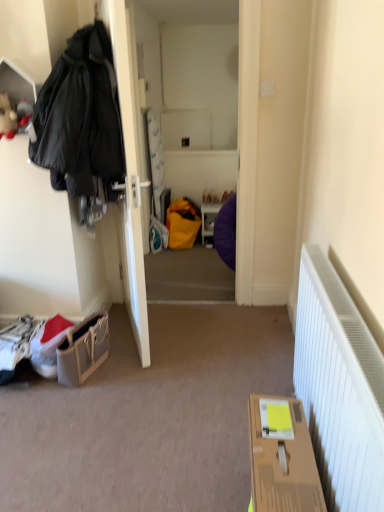
This screenshot has width=384, height=512. What do you see at coordinates (193, 102) in the screenshot? I see `matte purple bean bag at center` at bounding box center [193, 102].

The height and width of the screenshot is (512, 384). Describe the element at coordinates (83, 350) in the screenshot. I see `leather textured handbag at lower left` at that location.

What do you see at coordinates (282, 458) in the screenshot? I see `cardboard box at lower right` at bounding box center [282, 458].

Measure the distance between point (295, 446) and camera.

The depth of point (295, 446) is 1.34 meters.

In order to face matte white door at left, should I rotate leftwards or rightwards?

It's best to rotate left around 9.053 degrees.

Find the location of a particular element. Image resolution: width=384 pixels, height=512 pixels. matte purple bean bag at center is located at coordinates (193, 102).

From the image's perspective, between matte purple bean bag at center and fluffy plush toy at upper left, who is located below?

matte purple bean bag at center, from the image's perspective.

How different are the orientations of matte purple bean bag at center and fluffy plush toy at upper left in degrees?

1.65 degrees separate the facing orientations of matte purple bean bag at center and fluffy plush toy at upper left.

In terms of size, does matte purple bean bag at center appear bigger or smaller than fluffy plush toy at upper left?

In the image, matte purple bean bag at center appears to be larger than fluffy plush toy at upper left.

From a real-world perspective, between matte purple bean bag at center and fluffy plush toy at upper left, who is vertically higher?

fluffy plush toy at upper left.

Considering the sizes of objects fluffy plush toy at upper left and matte purple bean bag at center in the image provided, who is taller, fluffy plush toy at upper left or matte purple bean bag at center?

Standing taller between the two is matte purple bean bag at center.

Consider the image. From a real-world perspective, between fluffy plush toy at upper left and matte purple bean bag at center, who is vertically higher?

In real-world perspective, fluffy plush toy at upper left is above.

Can you tell me how much fluffy plush toy at upper left and matte purple bean bag at center differ in facing direction?

The angle between the facing direction of fluffy plush toy at upper left and the facing direction of matte purple bean bag at center is 1.65 degrees.

At what (x,y) coordinates should I click in order to perform the action: click on corridor below the fluffy plush toy at upper left (from the image's perspective). Please return your answer as a coordinate pair (x, y). This screenshot has height=512, width=384. Looking at the image, I should click on (193, 102).

Would you say leather textured handbag at lower left is a long distance from cardboard box at lower right?

That's right, there is a large distance between leather textured handbag at lower left and cardboard box at lower right.

From a real-world perspective, who is located lower, leather textured handbag at lower left or cardboard box at lower right?

In real-world perspective, leather textured handbag at lower left is lower.

Considering the positions of objects leather textured handbag at lower left and cardboard box at lower right in the image provided, who is more to the right, leather textured handbag at lower left or cardboard box at lower right?

cardboard box at lower right.

How distant is leather textured handbag at lower left from cardboard box at lower right?

leather textured handbag at lower left is 3.81 feet away from cardboard box at lower right.

Between matte black coat at left and fluffy plush toy at upper left, which one has more height?

matte black coat at left is taller.

Which object is thinner, matte black coat at left or fluffy plush toy at upper left?

With smaller width is fluffy plush toy at upper left.

Between matte black coat at left and fluffy plush toy at upper left, which one has smaller size?

fluffy plush toy at upper left.

Could you tell me if matte black coat at left is turned towards fluffy plush toy at upper left?

Yes, matte black coat at left is aimed at fluffy plush toy at upper left.

Where is `toy behind the matte white door at left`? toy behind the matte white door at left is located at coordinates (7, 117).

From a real-world perspective, which object stands above the other?

fluffy plush toy at upper left.

Does matte white door at left lie in front of fluffy plush toy at upper left?

Yes.

How different are the orientations of matte white door at left and fluffy plush toy at upper left in degrees?

There is a 109-degree angle between the facing directions of matte white door at left and fluffy plush toy at upper left.

Consider the image. Considering the relative sizes of matte purple bean bag at center and leather textured handbag at lower left in the image provided, is matte purple bean bag at center wider than leather textured handbag at lower left?

In fact, matte purple bean bag at center might be narrower than leather textured handbag at lower left.

From the image's perspective, does matte purple bean bag at center appear lower than leather textured handbag at lower left?

No, from the image's perspective, matte purple bean bag at center is not below leather textured handbag at lower left.

Which is more to the right, matte purple bean bag at center or leather textured handbag at lower left?

matte purple bean bag at center is more to the right.

Considering the points (15, 228) and (170, 94), which point is in front, point (15, 228) or point (170, 94)?

The point (15, 228) is closer.

From the image's perspective, who appears lower, matte black coat at left or matte purple bean bag at center?

matte black coat at left is shown below in the image.

Is matte black coat at left positioned in front of matte purple bean bag at center?

Yes, matte black coat at left is in front of matte purple bean bag at center.

Is matte black coat at left not close to matte purple bean bag at center?

Yes, matte black coat at left is far from matte purple bean bag at center.

Locate an element on the screen. This screenshot has height=512, width=384. corridor that is behind the fluffy plush toy at upper left is located at coordinates (193, 102).

You are a GUI agent. You are given a task and a screenshot of the screen. Output one action in this format:
    pyautogui.click(x=<x>, y=<y>)
    Task: Click on the corridor that appears below the fluffy plush toy at upper left (from a real-world perspective)
    The width and height of the screenshot is (384, 512).
    Given the screenshot: What is the action you would take?
    pyautogui.click(x=193, y=102)

Which object lies further to the anchor point matte purple bean bag at center, leather textured handbag at lower left or matte white door at left?

Among the two, leather textured handbag at lower left is located further to matte purple bean bag at center.

Estimate the real-world distances between objects in this image. Which object is closer to cardboard box at lower right, matte white door at left or fluffy plush toy at upper left?

matte white door at left is positioned closer to the anchor cardboard box at lower right.

Looking at this image, considering their positions, is leather textured handbag at lower left positioned further to matte black coat at left than fluffy plush toy at upper left?

Among the two, fluffy plush toy at upper left is located further to matte black coat at left.

Which object lies nearer to the anchor point cardboard box at lower right, matte purple bean bag at center or fluffy plush toy at upper left?

Among the two, fluffy plush toy at upper left is located nearer to cardboard box at lower right.

Looking at this image, looking at the image, which one is located further to cardboard box at lower right, fluffy plush toy at upper left or leather textured handbag at lower left?

fluffy plush toy at upper left lies further to cardboard box at lower right than the other object.

Estimate the real-world distances between objects in this image. Which object is closer to cardboard box at lower right, leather textured handbag at lower left or matte purple bean bag at center?

leather textured handbag at lower left is positioned closer to the anchor cardboard box at lower right.

Looking at this image, from the image, which object appears to be farther from cardboard box at lower right, matte black coat at left or matte purple bean bag at center?

matte purple bean bag at center lies further to cardboard box at lower right than the other object.

From the image, which object appears to be nearer to matte black coat at left, cardboard box at lower right or matte white door at left?

Based on the image, matte white door at left appears to be nearer to matte black coat at left.

You are a GUI agent. You are given a task and a screenshot of the screen. Output one action in this format:
    pyautogui.click(x=<x>, y=<y>)
    Task: Click on the cabinetry that lies between fluffy plush toy at upper left and cardboard box at lower right from top to bottom
    The image size is (384, 512).
    Given the screenshot: What is the action you would take?
    pyautogui.click(x=50, y=245)

This screenshot has width=384, height=512. Find the location of `handbag between matte white door at left and cardboard box at lower right from top to bottom`. handbag between matte white door at left and cardboard box at lower right from top to bottom is located at coordinates (83, 350).

Identify the location of door between matte black coat at left and cardboard box at lower right in the vertical direction. (129, 169).

The width and height of the screenshot is (384, 512). What are the coordinates of `corridor between fluffy plush toy at upper left and cardboard box at lower right vertically` in the screenshot? It's located at (193, 102).